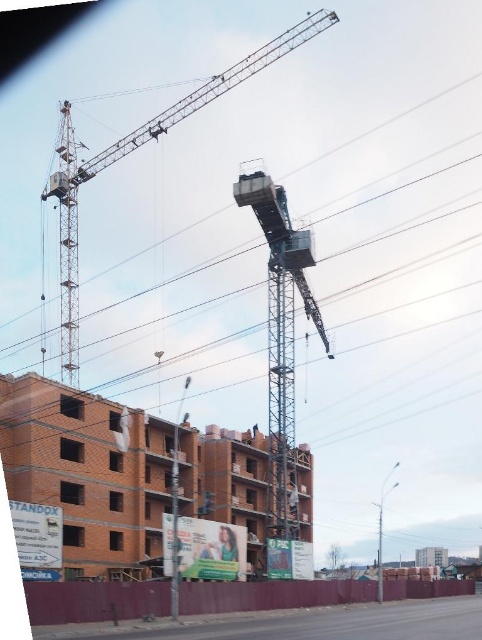
Question: Which point is farther to the camera?

Choices:
 (A) (297, 595)
 (B) (257, 429)
 (C) (272, 348)

Answer: (B)

Question: Where is brown brick wall at lower left located in relation to metallic gray crane at center in the image?

Choices:
 (A) below
 (B) above

Answer: (A)

Question: Is brick building at center thinner than metallic gray crane at center?

Choices:
 (A) yes
 (B) no

Answer: (B)

Question: Does brick building at center lie behind metallic gray crane at upper center?

Choices:
 (A) yes
 (B) no

Answer: (B)

Question: Based on their relative distances, which object is farther from the green fabric construction worker at center?

Choices:
 (A) metallic gray crane at upper center
 (B) blue fabric construction worker at center
 (C) metallic gray crane at center

Answer: (A)

Question: Considering the real-world distances, which object is closest to the brown brick wall at lower left?

Choices:
 (A) blue fabric construction worker at center
 (B) brick building at center

Answer: (B)